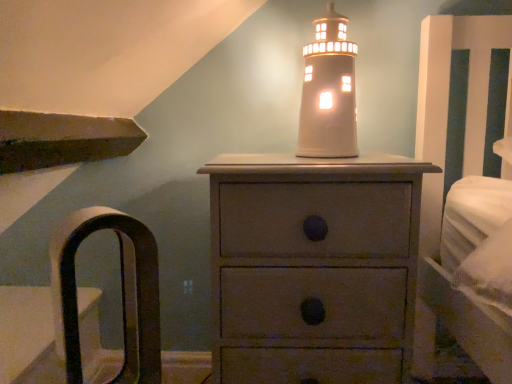
Question: From the image's perspective, is brown leather armchair at left located beneath white ceramic lighthouse at center?

Choices:
 (A) yes
 (B) no

Answer: (A)

Question: Is brown leather armchair at left bigger than white ceramic lighthouse at center?

Choices:
 (A) no
 (B) yes

Answer: (B)

Question: Would you say brown leather armchair at left contains white ceramic lighthouse at center?

Choices:
 (A) no
 (B) yes

Answer: (A)

Question: Does brown leather armchair at left have a lesser height compared to white ceramic lighthouse at center?

Choices:
 (A) yes
 (B) no

Answer: (B)

Question: Is brown leather armchair at left placed right next to white ceramic lighthouse at center?

Choices:
 (A) yes
 (B) no

Answer: (B)

Question: In the image, is matte gray chest of drawers at center on the left side or the right side of white ceramic lighthouse at center?

Choices:
 (A) right
 (B) left

Answer: (B)

Question: Which is correct: matte gray chest of drawers at center is inside white ceramic lighthouse at center, or outside of it?

Choices:
 (A) outside
 (B) inside

Answer: (A)

Question: Based on their sizes in the image, would you say matte gray chest of drawers at center is bigger or smaller than white ceramic lighthouse at center?

Choices:
 (A) small
 (B) big

Answer: (B)

Question: Does point (288, 223) appear closer or farther from the camera than point (323, 127)?

Choices:
 (A) closer
 (B) farther

Answer: (A)

Question: Is brown leather armchair at left situated inside matte gray chest of drawers at center or outside?

Choices:
 (A) inside
 (B) outside

Answer: (B)

Question: From the image's perspective, is brown leather armchair at left located above or below matte gray chest of drawers at center?

Choices:
 (A) below
 (B) above

Answer: (B)

Question: From their relative heights in the image, would you say brown leather armchair at left is taller or shorter than matte gray chest of drawers at center?

Choices:
 (A) short
 (B) tall

Answer: (A)

Question: Based on their sizes in the image, would you say brown leather armchair at left is bigger or smaller than matte gray chest of drawers at center?

Choices:
 (A) big
 (B) small

Answer: (B)

Question: In the image, is white ceramic lighthouse at center on the left side or the right side of matte gray chest of drawers at center?

Choices:
 (A) left
 (B) right

Answer: (B)

Question: From the image's perspective, is white ceramic lighthouse at center positioned above or below matte gray chest of drawers at center?

Choices:
 (A) below
 (B) above

Answer: (B)